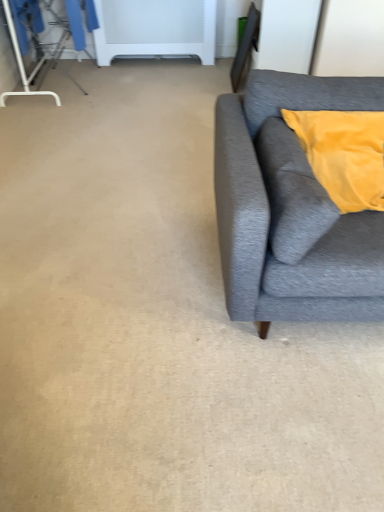
What is the approximate height of gray fabric couch at right?

gray fabric couch at right is 33.21 inches tall.

Image resolution: width=384 pixels, height=512 pixels. Find the location of `gray fabric couch at right`. gray fabric couch at right is located at coordinates (272, 209).

What is the approximate width of gray fabric couch at right?

gray fabric couch at right is 3.49 feet in width.

Describe the element at coordinates (272, 209) in the screenshot. I see `gray fabric couch at right` at that location.

Locate an element on the screen. The height and width of the screenshot is (512, 384). gray fabric couch at right is located at coordinates (272, 209).